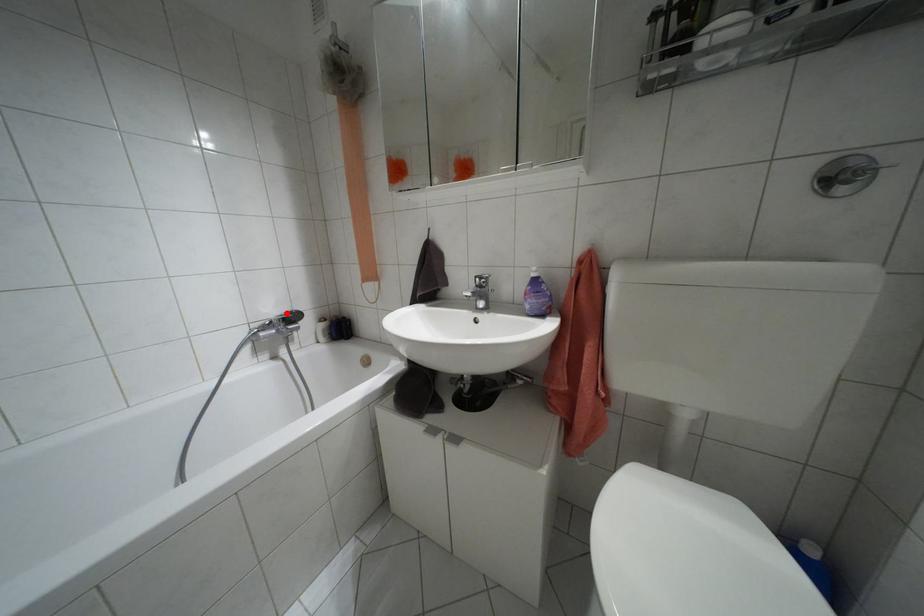
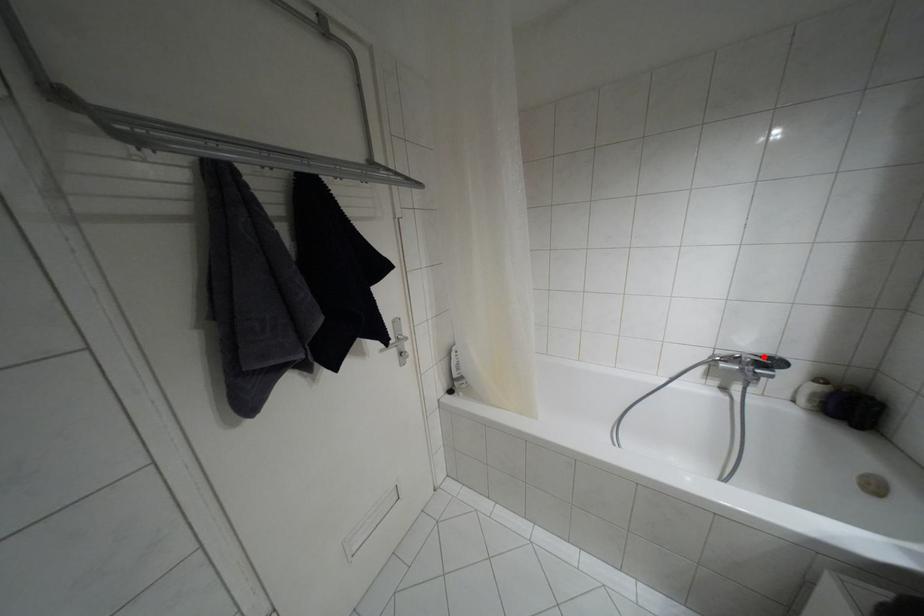
I am providing you with two images of the same scene from different viewpoints. A red point is marked on the first image and another point is marked on the second image. Is the marked point in image1 the same physical position as the marked point in image2?

Yes